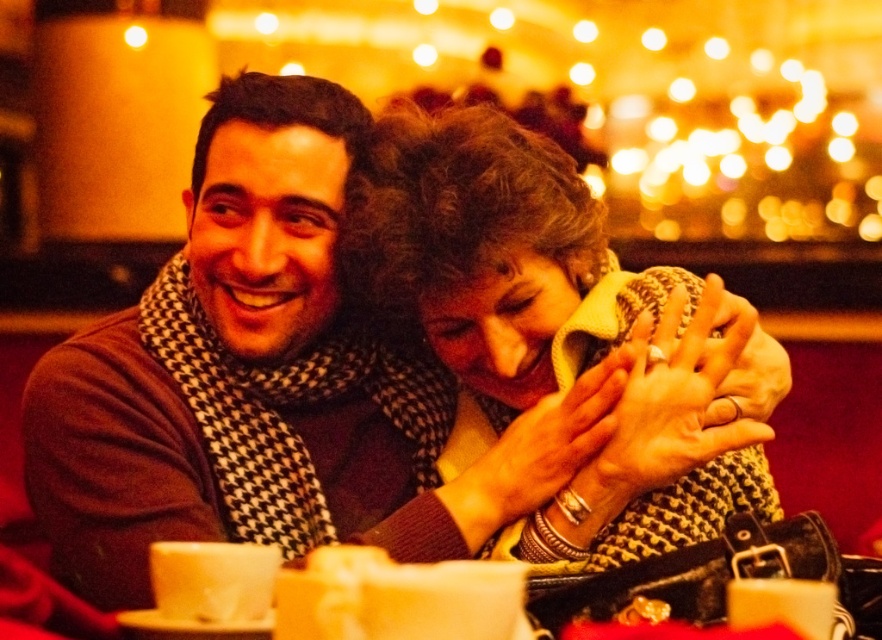
You are a photographer trying to capture a candid shot of the two people in the scene. You notice the brown wool sweater at left and the knitted yellow scarf at center. Which object is positioned higher in the frame?

The brown wool sweater at left is much taller than the knitted yellow scarf at center, so it is positioned higher in the frame.

You are a photographer trying to capture the brown wool sweater at left in the frame. The camera has a focus point at coordinates (238, 372). Is this point likely to be where the sweater is located?

Yes, the point (238, 372) marks the brown wool sweater at left, so the focus point is correctly placed there.

You are a photographer adjusting your camera settings to focus on the brown wool sweater at left and the knitted yellow scarf at center. Which object should you focus on first to ensure both are in sharp focus?

Result: You should focus on the brown wool sweater at left first because it is in front of the knitted yellow scarf at center, so starting with the closer object will help both be in focus.